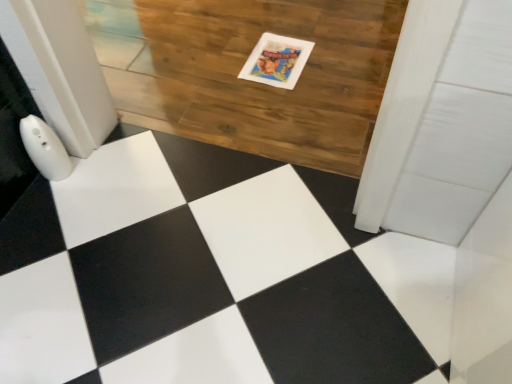
Locate an element on the screen. The image size is (512, 384). vacant area on top of matte paper postcard at upper center (from a real-world perspective) is located at coordinates (276, 57).